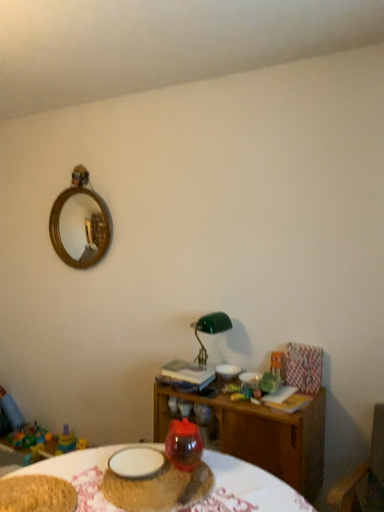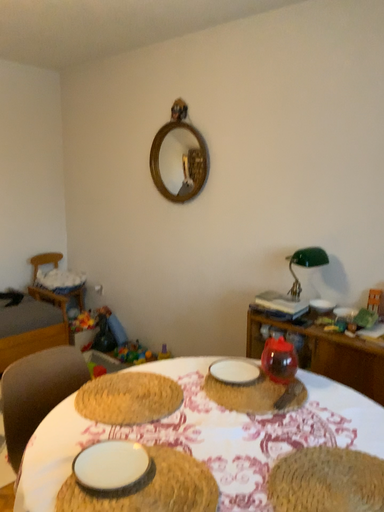
Question: How did the camera likely rotate when shooting the video?

Choices:
 (A) rotated right
 (B) rotated left

Answer: (B)